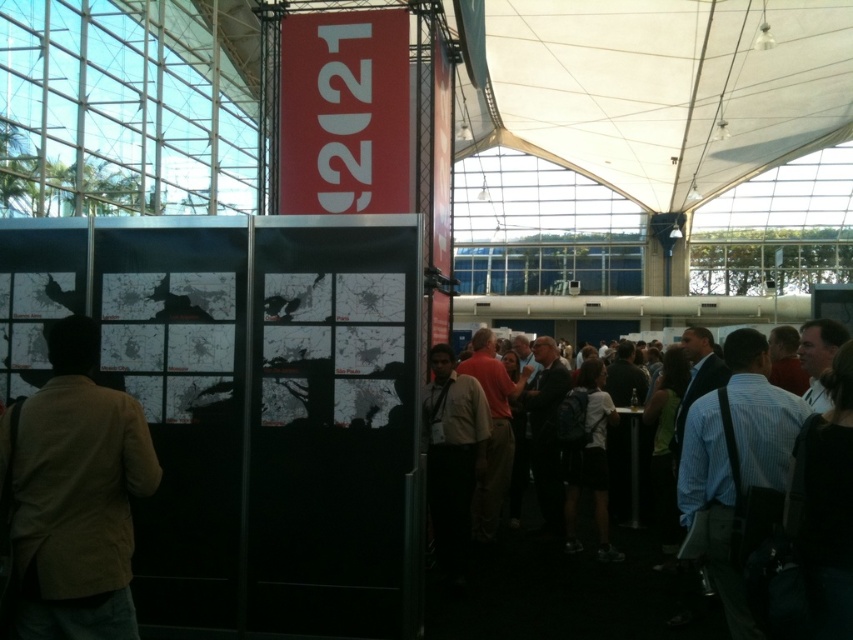
You are an event planner trying to set up a photo booth. You need to decide where to place it so that it can be seen from both the white fabric canopy at upper center and the dark clothing crowd at lower right. Which object is wider so that the photo booth can be placed under it for better visibility?

The white fabric canopy at upper center is wider than the dark clothing crowd at lower right, so placing the photo booth under the white fabric canopy at upper center would ensure better visibility from both locations.

You are standing in the exhibition space and see a light brown textured blazer at left. Where exactly is it located in the scene?

The light brown textured blazer at left is located at point (74, 496) in the scene.